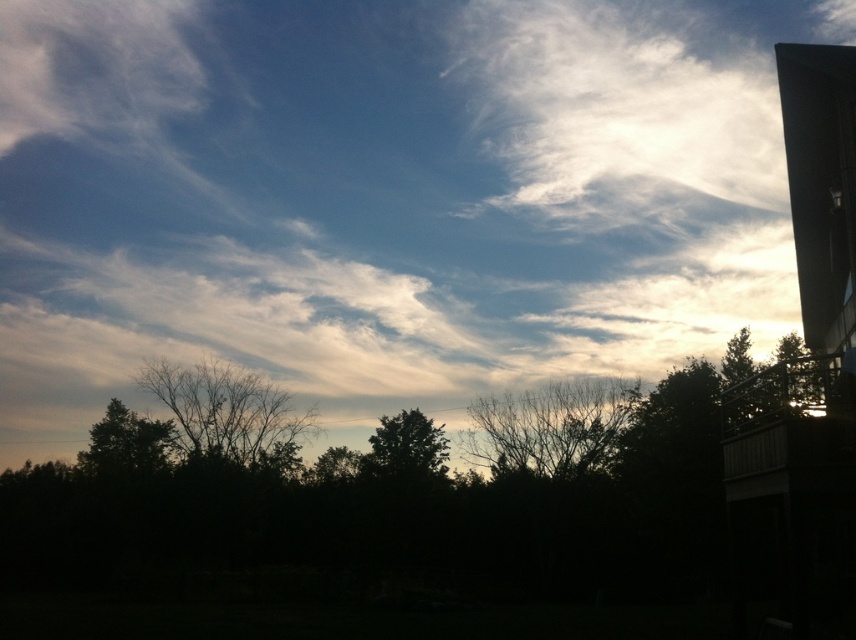
Based on the scene description, which tree has a greater width between the dark green leafy tree at lower left and the green leafy tree at center?

The dark green leafy tree at lower left has a greater width than the green leafy tree at center, as stated in the objects description.

Consider the image. You are standing in the middle of a forest and see the dark green leafy tree at lower left and the green leafy tree at center. Which tree is positioned higher in the image?

The dark green leafy tree at lower left is positioned higher than the green leafy tree at center in the image.